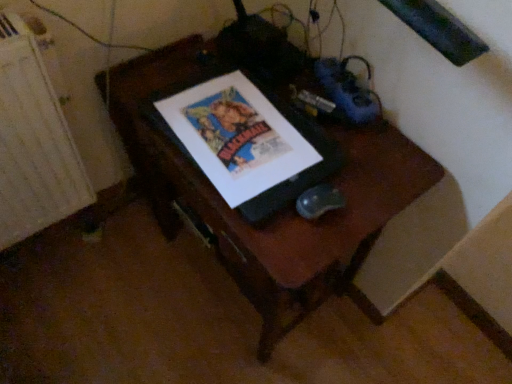
Locate an element on the screen. This screenshot has height=384, width=512. vacant space to the left of wooden desk at center is located at coordinates click(110, 294).